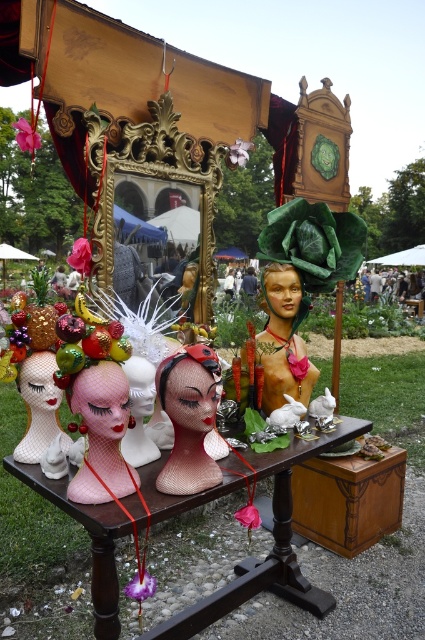
You are a vendor at the market and need to place a decorative item that is 10 inches wide on the wooden table at center. Can the satin pink wig at center be placed to the side without overlapping?

The wooden table at center is 11.00 inches away from the satin pink wig at center. Since the distance between them is greater than the item width of 10 inches, the wig can be placed to the side without overlapping.

You are setting up a display at an art fair and have a wooden table at center and a matte plastic doll at center. Which object should you place first if you want to ensure there is enough space for both items on your display area?

You should place the wooden table at center first because it is bigger than the matte plastic doll at center, ensuring there is enough space for both items.